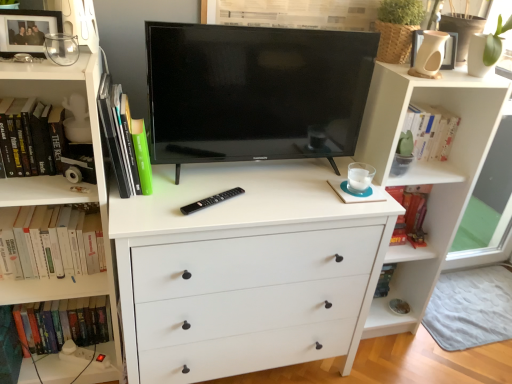
Find the location of `vacant space to the left of black plastic remote control at center`. vacant space to the left of black plastic remote control at center is located at coordinates (161, 201).